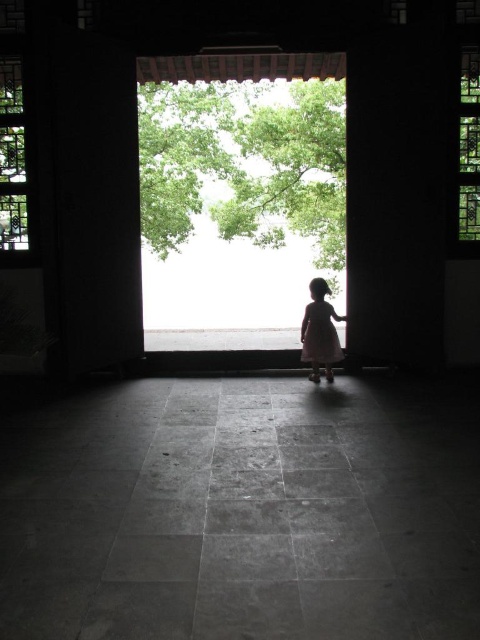
Does point (345, 188) come farther from viewer compared to point (12, 234)?

Yes, it is behind point (12, 234).

Is green leafy tree at center below translucent glass window at left?

No, green leafy tree at center is not below translucent glass window at left.

Is point (192, 99) positioned before point (2, 193)?

No, (192, 99) is further to viewer.

Find the location of `green leafy tree at center`. green leafy tree at center is located at coordinates (245, 164).

Who is positioned more to the right, translucent glass window at left or white matte dress at center?

white matte dress at center

How distant is translucent glass window at left from white matte dress at center?

The distance of translucent glass window at left from white matte dress at center is 3.03 meters.

Locate an element on the screen. The height and width of the screenshot is (640, 480). translucent glass window at left is located at coordinates (13, 160).

Does translucent glass window at left appear under green stained glass window at upper right?

Indeed, translucent glass window at left is positioned under green stained glass window at upper right.

Is point (20, 58) more distant than point (464, 195)?

No, it is not.

This screenshot has width=480, height=640. What do you see at coordinates (13, 160) in the screenshot?
I see `translucent glass window at left` at bounding box center [13, 160].

Where is `translucent glass window at left`? translucent glass window at left is located at coordinates (13, 160).